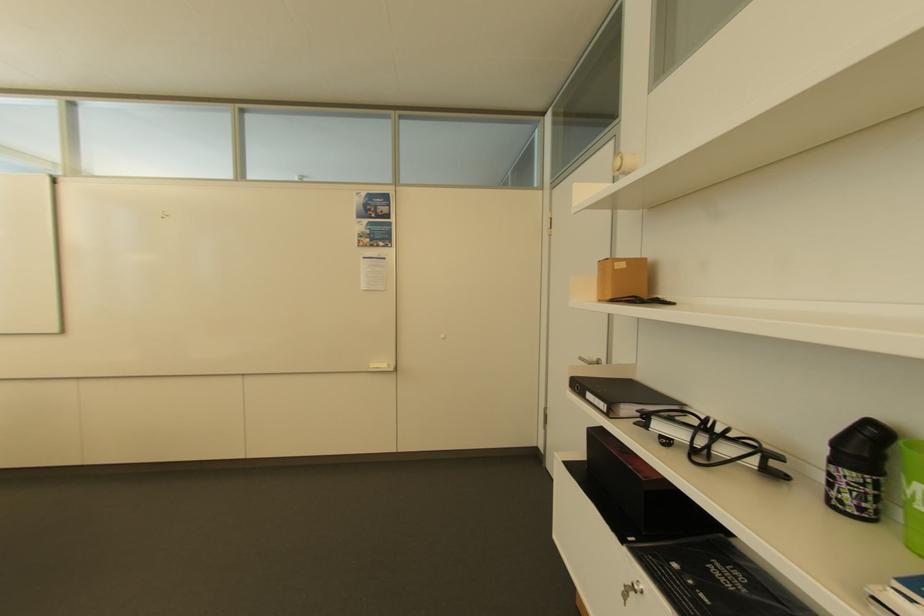
What do you see at coordinates (630, 590) in the screenshot? The height and width of the screenshot is (616, 924). I see `a cabinet lock key` at bounding box center [630, 590].